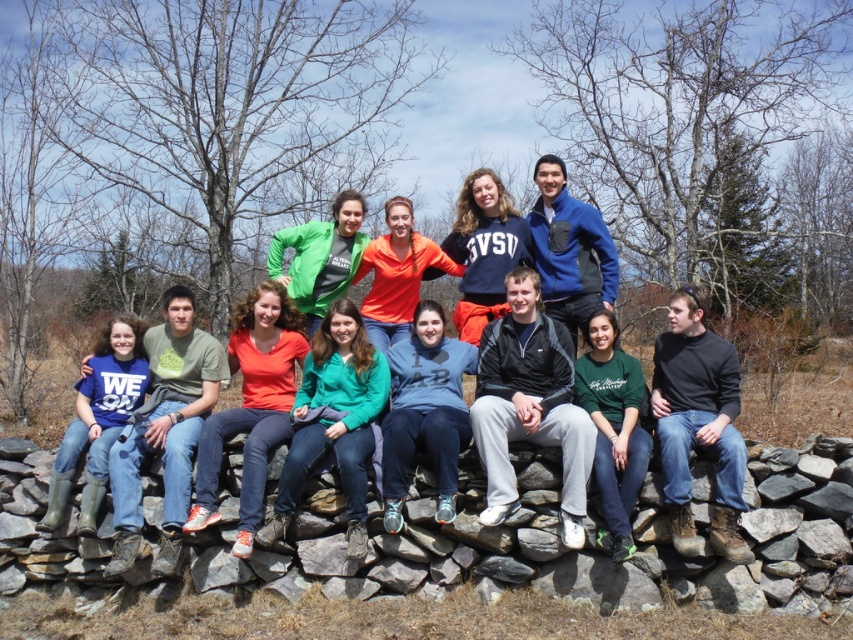
Question: Based on their relative distances, which object is farther from the gray stone at center?

Choices:
 (A) matte green hoodie at center
 (B) green matte sweatshirt at center

Answer: (A)

Question: Among these points, which one is nearest to the camera?

Choices:
 (A) (619, 547)
 (B) (350, 531)
 (C) (680, 451)
 (D) (550, 234)

Answer: (A)

Question: Observing the image, what is the correct spatial positioning of gray stone at center in reference to blue fleece sweatshirt at center?

Choices:
 (A) below
 (B) above

Answer: (A)

Question: Is black cotton shirt at lower right thinner than green matte sweatshirt at center?

Choices:
 (A) yes
 (B) no

Answer: (B)

Question: Does matte green hoodie at center have a smaller size compared to blue fleece sweatshirt at center?

Choices:
 (A) no
 (B) yes

Answer: (A)

Question: Which object is closer to the camera taking this photo?

Choices:
 (A) green matte sweatshirt at center
 (B) black cotton shirt at lower right
 (C) matte green hoodie at center

Answer: (B)